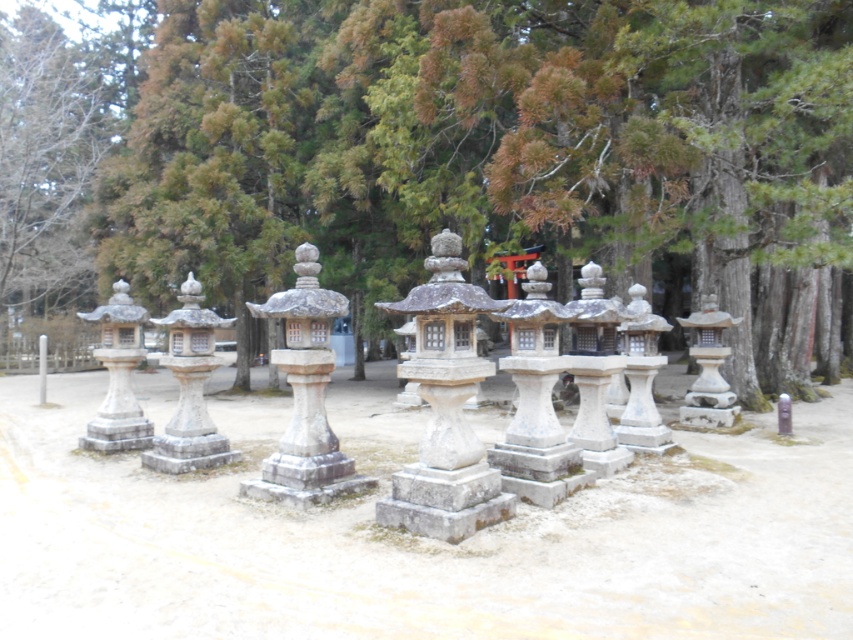
Who is taller, green textured tree at upper center or white stone lantern at center?

green textured tree at upper center

Does green textured tree at upper center have a lesser height compared to white stone lantern at center?

No.

What do you see at coordinates (440, 156) in the screenshot? Image resolution: width=853 pixels, height=640 pixels. I see `green textured tree at upper center` at bounding box center [440, 156].

The width and height of the screenshot is (853, 640). What are the coordinates of `green textured tree at upper center` in the screenshot? It's located at (440, 156).

Can you confirm if green textured tree at upper center is smaller than gray stone lantern at center?

No, green textured tree at upper center is not smaller than gray stone lantern at center.

Is point (299, 67) more distant than point (427, 428)?

That is True.

Where is `green textured tree at upper center`? green textured tree at upper center is located at coordinates (440, 156).

Is green textured tree at upper center thinner than white stone lantern at left?

No, green textured tree at upper center is not thinner than white stone lantern at left.

Is green textured tree at upper center wider than white stone lantern at left?

Answer: Indeed, green textured tree at upper center has a greater width compared to white stone lantern at left.

Identify the location of green textured tree at upper center. The image size is (853, 640). (440, 156).

The image size is (853, 640). In order to click on green textured tree at upper center in this screenshot , I will do `click(440, 156)`.